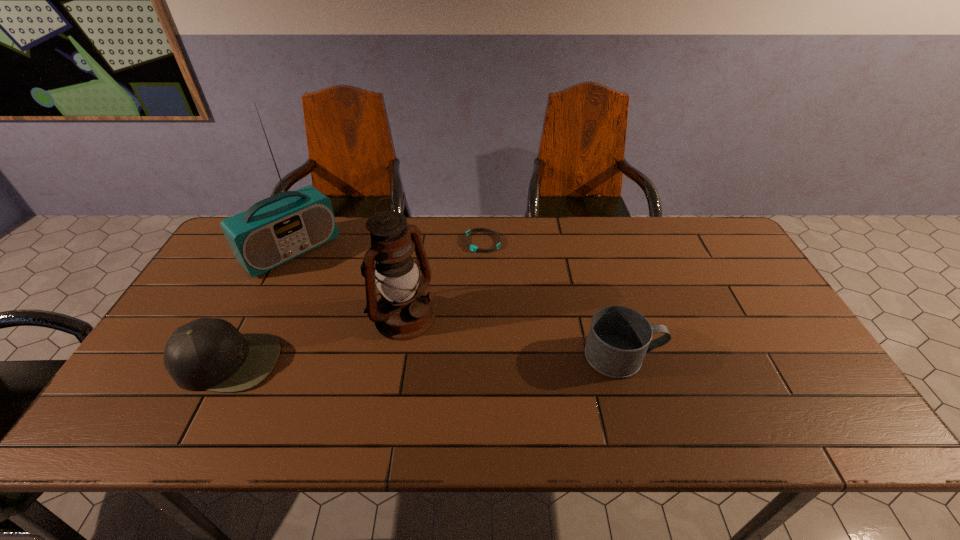
In order to click on cap in this screenshot , I will do `click(210, 354)`.

Where is `the rightmost object`? The width and height of the screenshot is (960, 540). the rightmost object is located at coordinates (619, 338).

I want to click on radio receiver, so click(279, 228).

The image size is (960, 540). Identify the location of the third object from right to left. (404, 312).

Find the location of a particular element. the fourth shortest object is located at coordinates (404, 312).

The height and width of the screenshot is (540, 960). Find the location of `wristband`. wristband is located at coordinates (473, 248).

Identify the location of the fourth object from left to right. (473, 248).

Locate an element on the screen. blank space located 0.260m on the side of the mug with the handle is located at coordinates (763, 356).

Identify the location of vacant space located on the front panel of the radio receiver. Image resolution: width=960 pixels, height=540 pixels. (391, 346).

Where is `free spot located 0.130m on the front panel of the radio receiver`? The width and height of the screenshot is (960, 540). free spot located 0.130m on the front panel of the radio receiver is located at coordinates (336, 293).